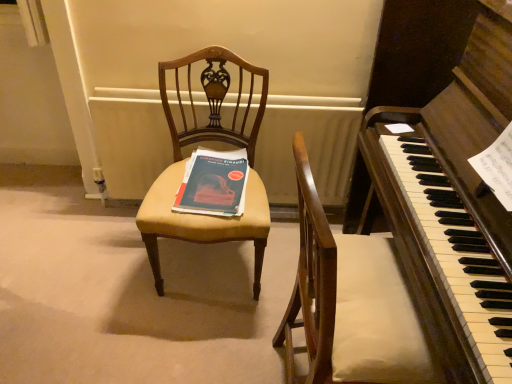
Question: Considering the relative sizes of white painted radiator at center and matte yellow fabric chair at center in the image provided, is white painted radiator at center shorter than matte yellow fabric chair at center?

Choices:
 (A) yes
 (B) no

Answer: (A)

Question: From the image's perspective, is white painted radiator at center under matte yellow fabric chair at center?

Choices:
 (A) yes
 (B) no

Answer: (B)

Question: Is white painted radiator at center oriented away from matte yellow fabric chair at center?

Choices:
 (A) yes
 (B) no

Answer: (A)

Question: Is white painted radiator at center to the left of matte yellow fabric chair at center from the viewer's perspective?

Choices:
 (A) yes
 (B) no

Answer: (B)

Question: Could you tell me if white painted radiator at center is facing matte yellow fabric chair at center?

Choices:
 (A) no
 (B) yes

Answer: (B)

Question: Considering the relative sizes of white painted radiator at center and matte yellow fabric chair at center in the image provided, is white painted radiator at center bigger than matte yellow fabric chair at center?

Choices:
 (A) no
 (B) yes

Answer: (A)

Question: From the image's perspective, is matte blue paper at center located above matte yellow fabric chair at center?

Choices:
 (A) no
 (B) yes

Answer: (B)

Question: Can you confirm if matte blue paper at center is wider than matte yellow fabric chair at center?

Choices:
 (A) yes
 (B) no

Answer: (B)

Question: Is matte blue paper at center not within matte yellow fabric chair at center?

Choices:
 (A) yes
 (B) no

Answer: (B)

Question: Does matte blue paper at center have a lesser height compared to matte yellow fabric chair at center?

Choices:
 (A) no
 (B) yes

Answer: (B)

Question: Does matte blue paper at center appear on the right side of matte yellow fabric chair at center?

Choices:
 (A) no
 (B) yes

Answer: (B)

Question: Can you confirm if matte blue paper at center is thinner than matte yellow fabric chair at center?

Choices:
 (A) yes
 (B) no

Answer: (A)

Question: Is matte blue paper at center not within white painted radiator at center?

Choices:
 (A) yes
 (B) no

Answer: (A)